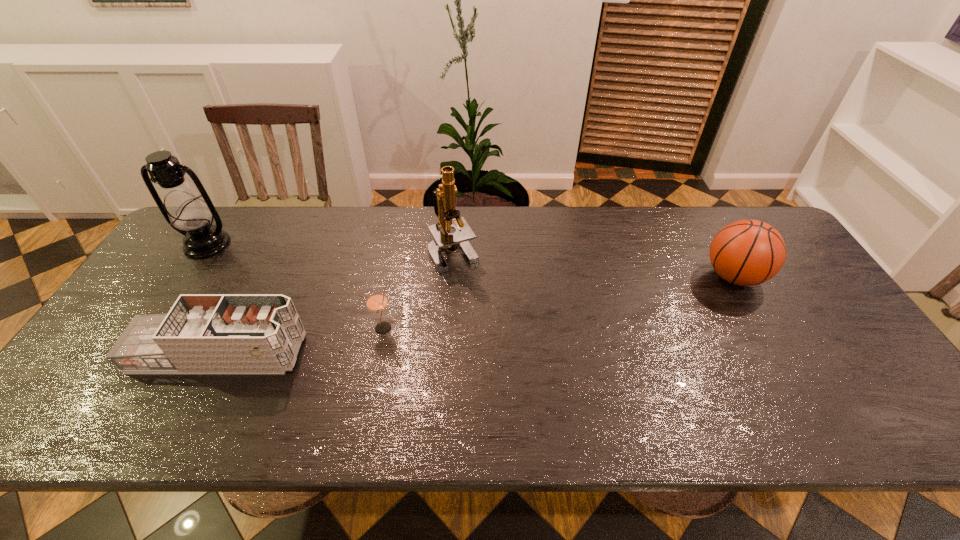
Find the location of a particular element. free space that satisfies the following two spatial constraints: 1. on the front side of the rightmost object; 2. at the entrance of the dollhouse is located at coordinates (778, 353).

Where is `vacant space that satisfies the following two spatial constraints: 1. on the front side of the basketball; 2. on the right side of the oil lamp`? The width and height of the screenshot is (960, 540). vacant space that satisfies the following two spatial constraints: 1. on the front side of the basketball; 2. on the right side of the oil lamp is located at coordinates 185,276.